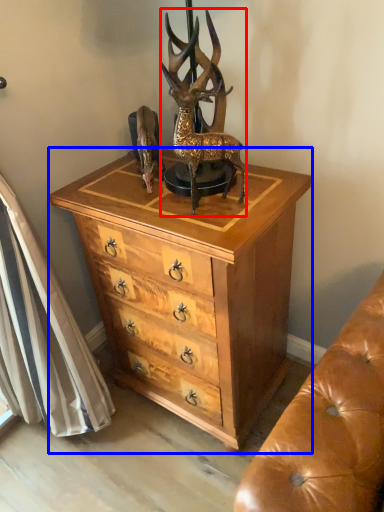
Question: Which point is closer to the camera, deer (highlighted by a red box) or chest of drawers (highlighted by a blue box)?

Choices:
 (A) deer
 (B) chest of drawers

Answer: (A)